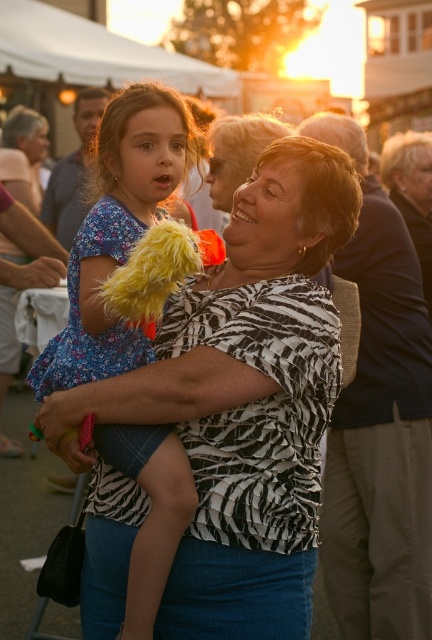
Question: Which of the following is the closest to the observer?

Choices:
 (A) (199, 525)
 (B) (136, 212)

Answer: (A)

Question: Is zebra-patterned blouse at center above fluffy yellow toy at center?

Choices:
 (A) yes
 (B) no

Answer: (B)

Question: Considering the relative positions of zebra-patterned blouse at center and fluffy yellow toy at center in the image provided, where is zebra-patterned blouse at center located with respect to fluffy yellow toy at center?

Choices:
 (A) above
 (B) below

Answer: (B)

Question: Which point appears farthest from the camera in this image?

Choices:
 (A) tap(124, 252)
 (B) tap(187, 412)

Answer: (A)

Question: Does zebra-patterned blouse at center appear on the right side of fluffy yellow toy at center?

Choices:
 (A) no
 (B) yes

Answer: (B)